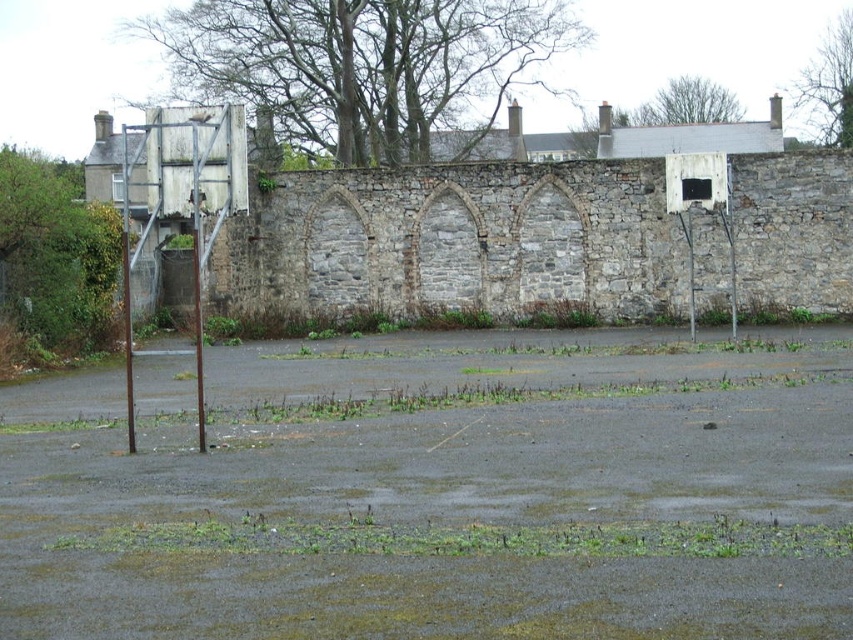
Can you confirm if metallic gray basketball hoop at left is positioned above white painted metal basketball hoop at right?

Yes.

The height and width of the screenshot is (640, 853). What are the coordinates of `metallic gray basketball hoop at left` in the screenshot? It's located at (183, 202).

I want to click on metallic gray basketball hoop at left, so click(183, 202).